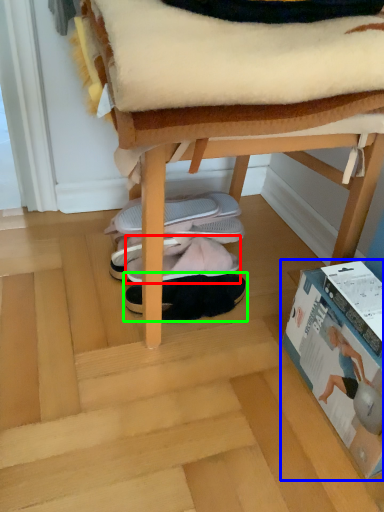
Question: Which is nearer to the footwear (highlighted by a red box)? paperback book (highlighted by a blue box) or footwear (highlighted by a green box).

Choices:
 (A) paperback book
 (B) footwear

Answer: (B)